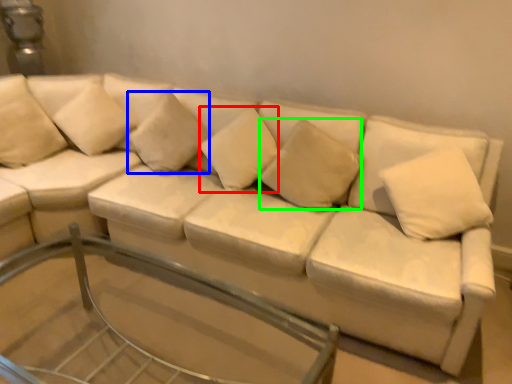
Question: Which object is positioned closest to pillow (highlighted by a red box)? Select from pillow (highlighted by a blue box) and pillow (highlighted by a green box).

Choices:
 (A) pillow
 (B) pillow

Answer: (B)